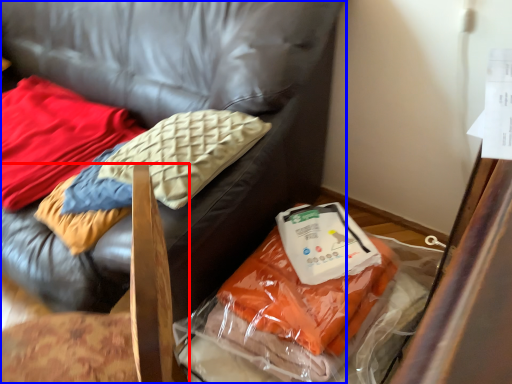
Question: Which object is closer to the camera taking this photo, furniture (highlighted by a red box) or furniture (highlighted by a blue box)?

Choices:
 (A) furniture
 (B) furniture

Answer: (A)